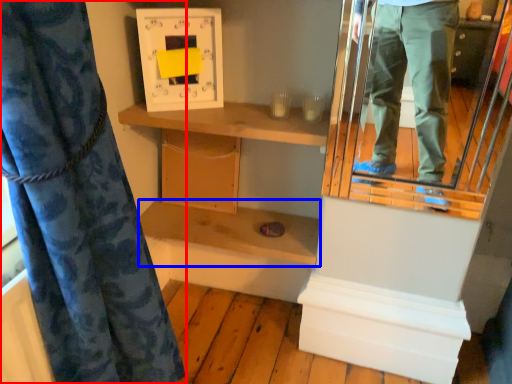
Question: Which object is further to the camera taking this photo, curtain (highlighted by a red box) or shelf (highlighted by a blue box)?

Choices:
 (A) curtain
 (B) shelf

Answer: (B)